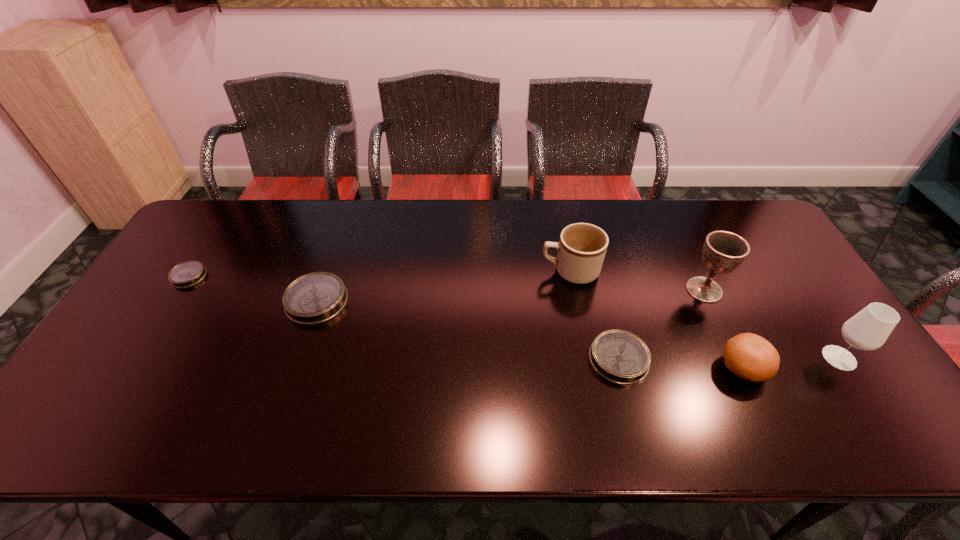
The height and width of the screenshot is (540, 960). I want to click on clementine at the near edge, so coord(749,356).

Locate an element on the screen. The height and width of the screenshot is (540, 960). object at the left edge is located at coordinates (186, 274).

The image size is (960, 540). I want to click on object that is at the right edge, so pyautogui.click(x=869, y=329).

This screenshot has height=540, width=960. Identify the location of object that is at the near right corner. (869, 329).

In the image, there is a desktop. What are the coordinates of `vacant space at the far edge` in the screenshot? It's located at (313, 205).

Locate an element on the screen. The width and height of the screenshot is (960, 540). vacant space at the near edge is located at coordinates (691, 401).

You are a GUI agent. You are given a task and a screenshot of the screen. Output one action in this format:
    pyautogui.click(x=<x>, y=<y>)
    Task: Click on the free point at the left edge
    
    Given the screenshot: What is the action you would take?
    pyautogui.click(x=155, y=320)

Find the location of a particular element. The height and width of the screenshot is (540, 960). vacant area at the right edge of the desktop is located at coordinates (781, 251).

The image size is (960, 540). I want to click on vacant space at the far left corner of the desktop, so click(x=206, y=240).

Locate an element on the screen. Image resolution: width=960 pixels, height=540 pixels. free space at the far right corner of the desktop is located at coordinates click(747, 226).